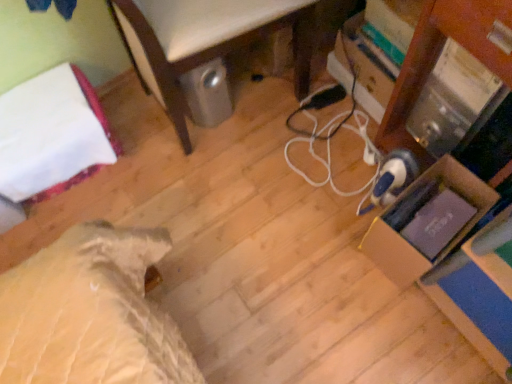
What is the approximate height of white fabric bed at left?

The height of white fabric bed at left is 9.08 inches.

This screenshot has width=512, height=384. Find the location of `white fabric bed at left`. white fabric bed at left is located at coordinates (52, 135).

This screenshot has width=512, height=384. What do you see at coordinates (330, 137) in the screenshot? I see `white cord at center` at bounding box center [330, 137].

What is the approximate width of metallic silver trash can at lower center?

metallic silver trash can at lower center is 57.93 centimeters wide.

Find the location of a particular element. This screenshot has width=512, height=384. white fabric bed at left is located at coordinates (52, 135).

Is cardboard box at right positioned with its back to metallic silver trash can at lower center?

No, cardboard box at right is not facing the opposite direction of metallic silver trash can at lower center.

From the image's perspective, would you say cardboard box at right is positioned over metallic silver trash can at lower center?

No, from the image's perspective, cardboard box at right is not above metallic silver trash can at lower center.

How distant is cardboard box at right from metallic silver trash can at lower center?

23.88 inches.

Can you tell me how much cardboard box at right and metallic silver trash can at lower center differ in facing direction?

There is a 173-degree angle between the facing directions of cardboard box at right and metallic silver trash can at lower center.

This screenshot has height=384, width=512. I want to click on cable located underneath the white fabric bed at left (from a real-world perspective), so click(x=330, y=137).

Are white fabric bed at left and white cord at center located far from each other?

No, there isn't a large distance between white fabric bed at left and white cord at center.

How many degrees apart are the facing directions of white fabric bed at left and white cord at center?

87.5 degrees separate the facing orientations of white fabric bed at left and white cord at center.

Consider the image. Considering their positions, is white fabric bed at left located in front of or behind metallic silver trash can at lower center?

Visually, white fabric bed at left is located behind metallic silver trash can at lower center.

Which is nearer, (2,166) or (168,7)?

Point (2,166) appears to be farther away from the viewer than point (168,7).

In the scene shown: From a real-world perspective, which is physically above, white fabric bed at left or metallic silver trash can at lower center?

In real-world perspective, metallic silver trash can at lower center is above.

Consider the image. From the image's perspective, would you say white fabric bed at left is shown under metallic silver trash can at lower center?

Yes, from the image's perspective, white fabric bed at left is below metallic silver trash can at lower center.

Is white fabric bed at left in contact with cardboard box at right?

No, white fabric bed at left is not beside cardboard box at right.

How different are the orientations of white fabric bed at left and cardboard box at right in degrees?

The angle between the facing direction of white fabric bed at left and the facing direction of cardboard box at right is 87.5 degrees.

Is white fabric bed at left situated inside cardboard box at right or outside?

white fabric bed at left is not enclosed by cardboard box at right.

Is white fabric bed at left to the left or to the right of cardboard box at right in the image?

In the image, white fabric bed at left appears on the left side of cardboard box at right.

Image resolution: width=512 pixels, height=384 pixels. I want to click on cardboard box lying on the right of white cord at center, so click(426, 221).

Do you think cardboard box at right is within white cord at center, or outside of it?

cardboard box at right is outside white cord at center.

Is white cord at center aimed at cardboard box at right?

No, white cord at center is not facing towards cardboard box at right.

How different are the orientations of white cord at center and cardboard box at right in degrees?

They differ by 0.000338 degrees in their facing directions.

Looking at the image, does white cord at center seem bigger or smaller compared to cardboard box at right?

Clearly, white cord at center is smaller in size than cardboard box at right.

Where is `cable located behind the cardboard box at right`? This screenshot has height=384, width=512. cable located behind the cardboard box at right is located at coordinates (330, 137).

Is the surface of metallic silver trash can at lower center in direct contact with white cord at center?

No, metallic silver trash can at lower center is not beside white cord at center.

Considering the positions of points (292, 26) and (365, 119), is point (292, 26) closer to camera compared to point (365, 119)?

Yes, point (292, 26) is in front of point (365, 119).

How far apart are metallic silver trash can at lower center and white cord at center?

metallic silver trash can at lower center is 13.94 inches away from white cord at center.

From the image's perspective, who appears lower, metallic silver trash can at lower center or white cord at center?

white cord at center.

The image size is (512, 384). I want to click on furniture lying in front of the cardboard box at right, so click(x=209, y=40).

At what (x,y) coordinates should I click in order to perform the action: click on bed that is above the white cord at center (from the image's perspective). Please return your answer as a coordinate pair (x, y). The image size is (512, 384). Looking at the image, I should click on (52, 135).

Based on the photo, which object lies further to the anchor point cardboard box at right, white fabric bed at left or white cord at center?

The object further to cardboard box at right is white fabric bed at left.

Looking at this image, which object lies further to the anchor point white cord at center, cardboard box at right or white fabric bed at left?

Among the two, white fabric bed at left is located further to white cord at center.

Estimate the real-world distances between objects in this image. Which object is further from cardboard box at right, white fabric bed at left or metallic silver trash can at lower center?

The object further to cardboard box at right is white fabric bed at left.

When comparing their distances from white fabric bed at left, does cardboard box at right or metallic silver trash can at lower center seem further?

cardboard box at right.

Considering their positions, is white fabric bed at left positioned further to white cord at center than metallic silver trash can at lower center?

Among the two, white fabric bed at left is located further to white cord at center.

Estimate the real-world distances between objects in this image. Which object is closer to cardboard box at right, metallic silver trash can at lower center or white cord at center?

Based on the image, white cord at center appears to be nearer to cardboard box at right.

Considering their positions, is white cord at center positioned further to cardboard box at right than metallic silver trash can at lower center?

metallic silver trash can at lower center is further to cardboard box at right.

Which object lies further to the anchor point white fabric bed at left, cardboard box at right or white cord at center?

cardboard box at right lies further to white fabric bed at left than the other object.

Identify the location of furniture between white fabric bed at left and white cord at center from left to right. This screenshot has width=512, height=384. (209, 40).

Identify the location of cable between metallic silver trash can at lower center and cardboard box at right. (330, 137).

Where is `cable between white fabric bed at left and cardboard box at right from left to right`? This screenshot has height=384, width=512. cable between white fabric bed at left and cardboard box at right from left to right is located at coordinates (330, 137).

Find the location of a particular element. Image resolution: width=512 pixels, height=384 pixels. furniture between white fabric bed at left and cardboard box at right from left to right is located at coordinates (209, 40).